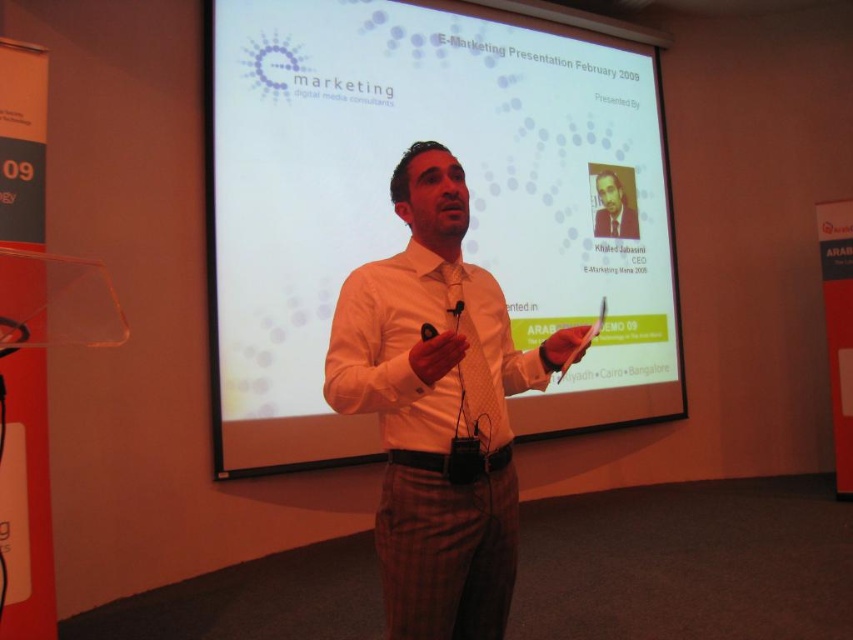
You are sitting in the audience and want to see both the white textured shirt at center and the matte white shirt at center clearly. Which one will appear larger to you?

The white textured shirt at center will appear larger because it is closer to you than the matte white shirt at center.

You are standing in the conference room and want to adjust the screen. Where is the white matte projection screen at center located?

The white matte projection screen at center is located at point (402, 225).